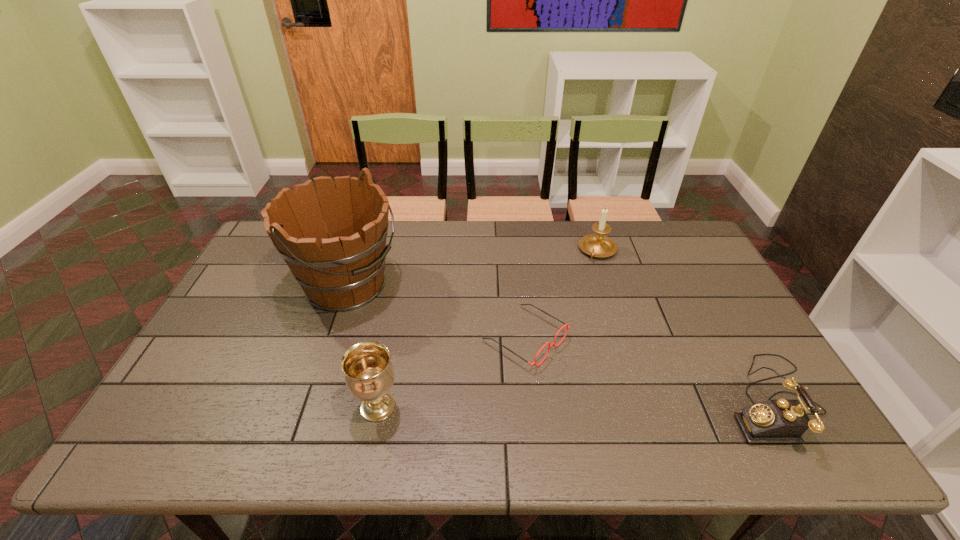
Image resolution: width=960 pixels, height=540 pixels. What are the coordinates of `vacant space on the desktop that is between the chalice and the fourth tallest object and is positioned with the handle on the wine bucket` in the screenshot? It's located at (588, 403).

Where is `vacant spot on the desktop that is between the chalice and the rightmost object and is positioned on the front-facing side of the shortest object`? Image resolution: width=960 pixels, height=540 pixels. vacant spot on the desktop that is between the chalice and the rightmost object and is positioned on the front-facing side of the shortest object is located at coordinates (630, 403).

Image resolution: width=960 pixels, height=540 pixels. What are the coordinates of `free space on the desktop that is between the chalice and the telephone and is positioned with a handle on the side of the second object from right to left` in the screenshot? It's located at (533, 404).